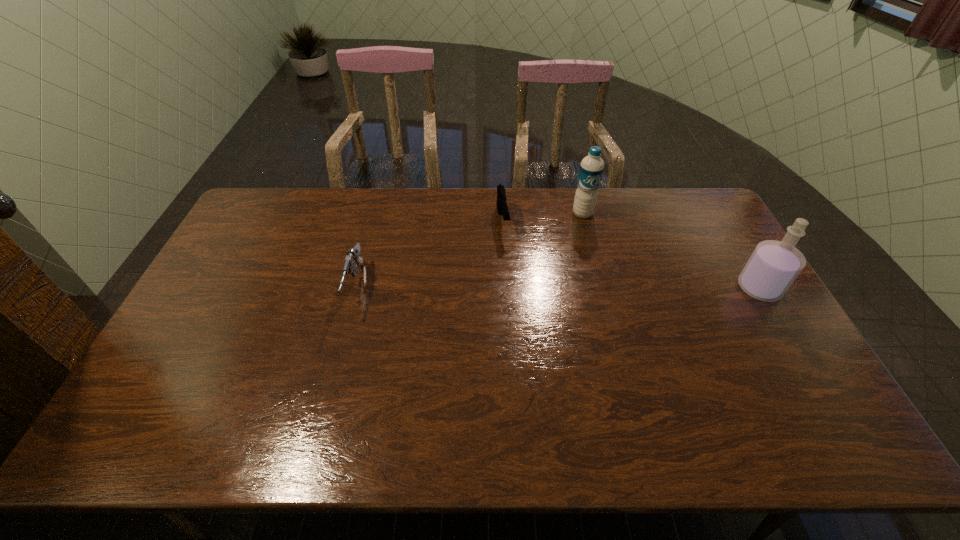
You are a GUI agent. You are given a task and a screenshot of the screen. Output one action in this format:
    pyautogui.click(x=<x>, y=<y>)
    Task: Click on the free spot on the desktop that is between the gun and the perfume and is positioned on the front-facing side of the third object from right to left
    
    Given the screenshot: What is the action you would take?
    pyautogui.click(x=516, y=288)

The height and width of the screenshot is (540, 960). Identify the location of free spot on the desktop that is between the gun and the rightmost object and is positioned on the label of the water bottle. (613, 288).